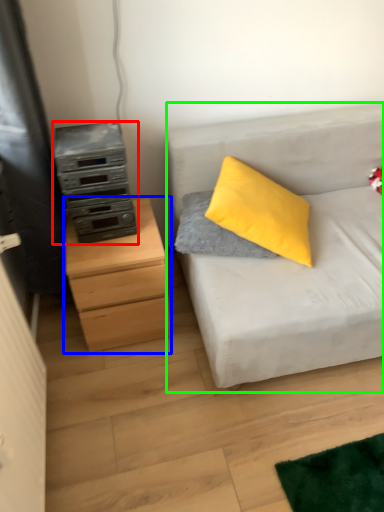
Question: Estimate the real-world distances between objects in this image. Which object is farther from appliance (highlighted by a red box), chest of drawers (highlighted by a blue box) or studio couch (highlighted by a green box)?

Choices:
 (A) chest of drawers
 (B) studio couch

Answer: (B)